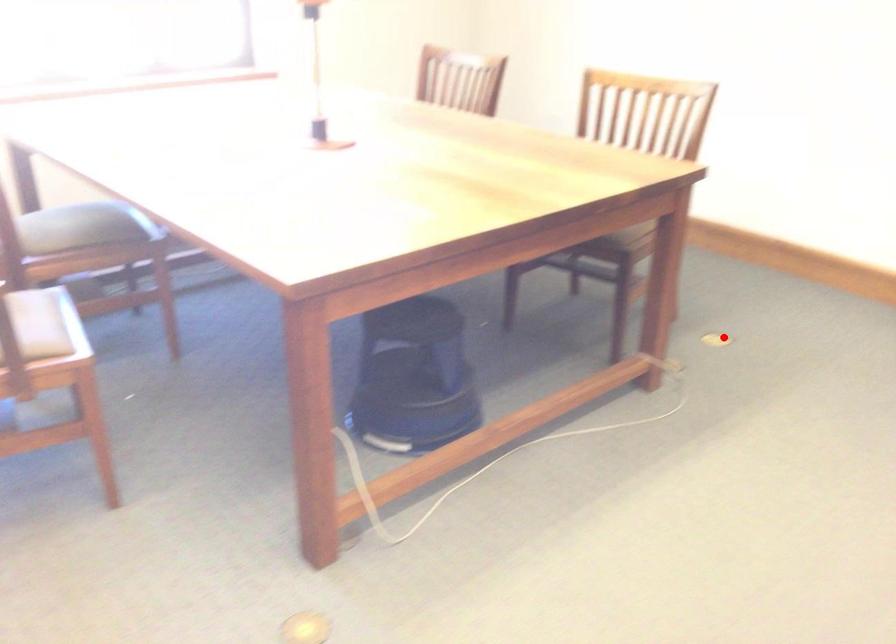
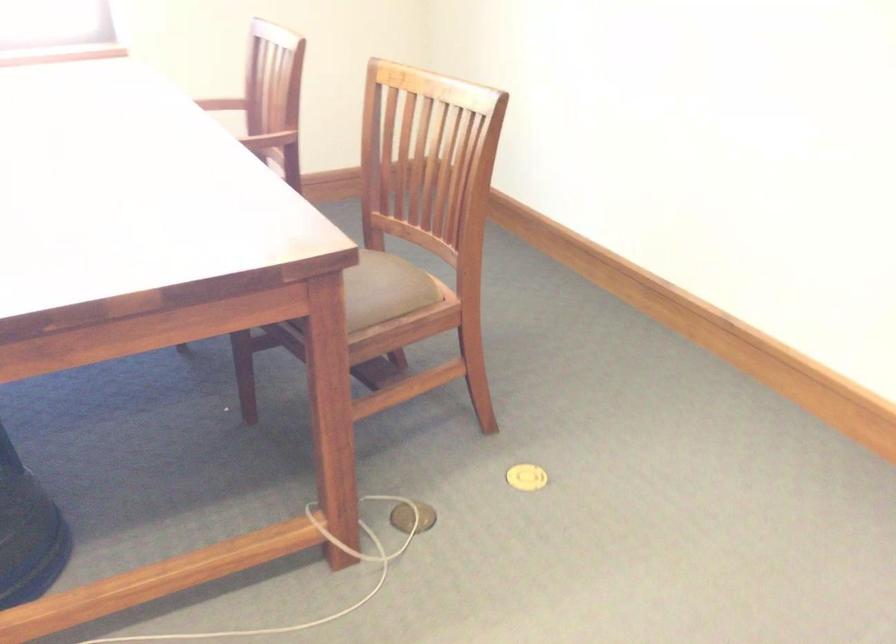
The point at the highlighted location is marked in the first image. Where is the corresponding point in the second image?

(526, 477)